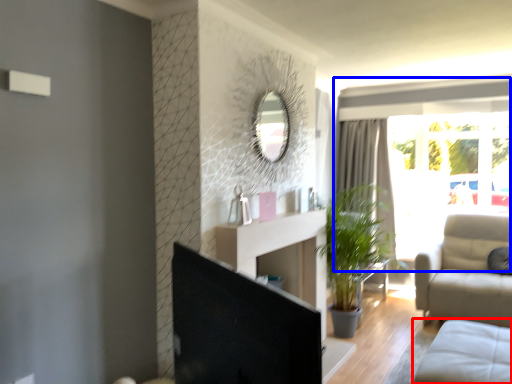
Question: Which of the following is the farthest to the observer, studio couch (highlighted by a red box) or window (highlighted by a blue box)?

Choices:
 (A) studio couch
 (B) window

Answer: (B)